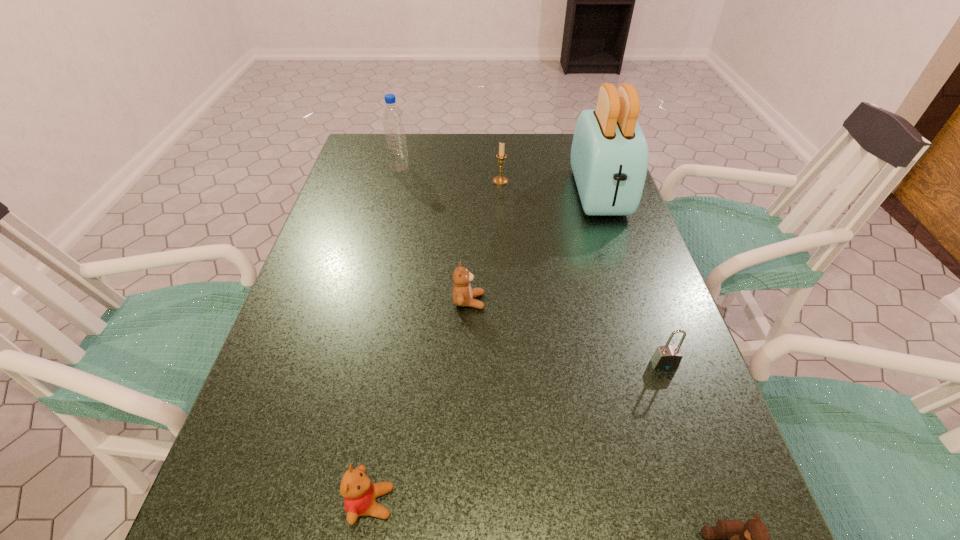
Identify the location of vacant area situated on the right of the sixth shortest object. (429, 168).

What are the coordinates of `free spot located 0.100m on the front of the fourth object from left to right` in the screenshot? It's located at (502, 206).

Locate an element on the screen. vacant area situated on the front-facing side of the fourth nearest object is located at coordinates pyautogui.click(x=660, y=301).

Locate an element on the screen. The height and width of the screenshot is (540, 960). free space located on the shackle of the third nearest object is located at coordinates (699, 464).

Locate an element on the screen. Image resolution: width=960 pixels, height=540 pixels. vacant space located on the front-facing side of the leftmost teddy bear is located at coordinates (625, 502).

Identify the location of toaster that is at the far edge. (609, 158).

The height and width of the screenshot is (540, 960). Find the location of `water bottle present at the far edge`. water bottle present at the far edge is located at coordinates (393, 122).

The width and height of the screenshot is (960, 540). In order to click on object that is at the left edge in this screenshot , I will do `click(393, 122)`.

Where is `toaster located in the right edge section of the desktop`? toaster located in the right edge section of the desktop is located at coordinates (609, 158).

The width and height of the screenshot is (960, 540). Identify the location of padlock situated at the right edge. (667, 357).